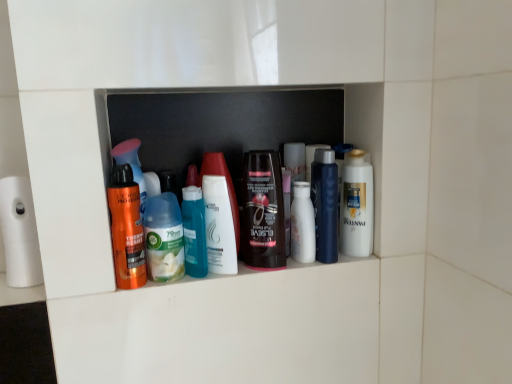
Question: Would you say shiny brown bottle at center, placed as the 3th toiletry when sorted from right to left, is to the left or to the right of white glossy mouthwash at center right in the picture?

Choices:
 (A) right
 (B) left

Answer: (B)

Question: Based on their sizes in the image, would you say shiny brown bottle at center, placed as the 3th toiletry when sorted from right to left, is bigger or smaller than white glossy mouthwash at center right?

Choices:
 (A) small
 (B) big

Answer: (B)

Question: Estimate the real-world distances between objects in this image. Which object is farther from the translucent plastic bottles at center?

Choices:
 (A) metallic blue hair spray at center, placed as the first toiletry when sorted from right to left
 (B) white glossy lotion at center, the third toiletry viewed from the left
 (C) shiny brown bottle at center, placed as the 3th toiletry when sorted from right to left
 (D) white glossy body wash at center
 (E) shiny orange spray can at left, the first toiletry in the left-to-right sequence

Answer: (E)

Question: Estimate the real-world distances between objects in this image. Which object is farther from the white matte toilet paper at left?

Choices:
 (A) white glossy lotion at center, the fifth toiletry in the left-to-right sequence
 (B) translucent plastic bottles at center
 (C) shiny brown bottle at center, placed as the 3th toiletry when sorted from right to left
 (D) white glossy body wash at center
 (E) translucent plastic bottle at center, the 5th toiletry when ordered from right to left

Answer: (A)